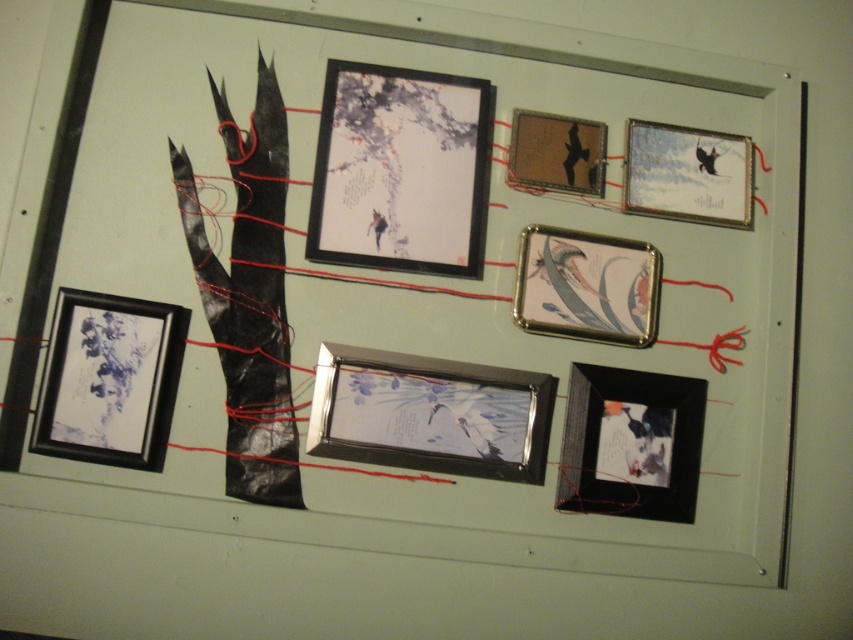
Is metallic silver picture frame at center-right above metallic gold picture frame at upper center?

Actually, metallic silver picture frame at center-right is below metallic gold picture frame at upper center.

What do you see at coordinates (585, 285) in the screenshot? The height and width of the screenshot is (640, 853). I see `metallic silver picture frame at center-right` at bounding box center [585, 285].

The width and height of the screenshot is (853, 640). What are the coordinates of `metallic silver picture frame at center-right` in the screenshot? It's located at (585, 285).

Can you confirm if matte black picture frame at lower left is thinner than metallic gold picture frame at upper center?

In fact, matte black picture frame at lower left might be wider than metallic gold picture frame at upper center.

Is matte black picture frame at lower left further to the viewer compared to metallic gold picture frame at upper center?

That is False.

Is point (120, 422) behind point (532, 125)?

No.

Find the location of a particular element. This screenshot has width=853, height=640. matte black picture frame at lower left is located at coordinates (109, 380).

Does matte black picture frame at lower left appear under black glossy picture frame at lower right?

Actually, matte black picture frame at lower left is above black glossy picture frame at lower right.

Can you confirm if matte black picture frame at lower left is bigger than black glossy picture frame at lower right?

Yes.

Which is behind, point (167, 380) or point (583, 372)?

The point (583, 372) is more distant.

This screenshot has width=853, height=640. Find the location of `matte black picture frame at lower left`. matte black picture frame at lower left is located at coordinates (109, 380).